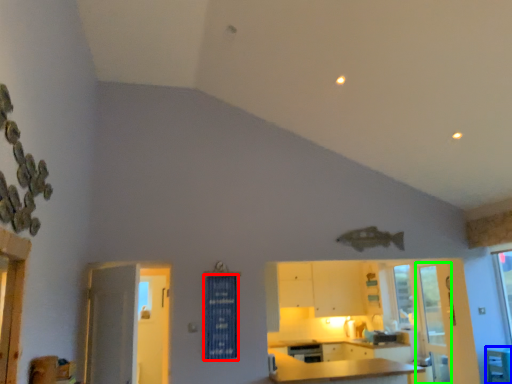
Question: Which is nearer to the curtain (highlighted by a red box)? table (highlighted by a blue box) or screen door (highlighted by a green box).

Choices:
 (A) table
 (B) screen door

Answer: (B)